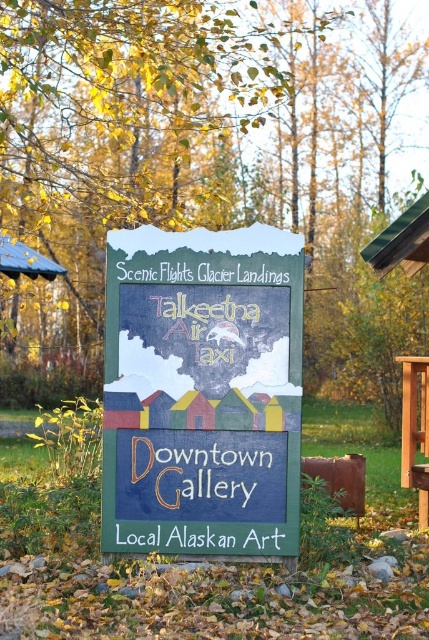
Question: Does wooden signboard at center come behind brown wooden picnic table at right?

Choices:
 (A) yes
 (B) no

Answer: (B)

Question: Is wooden signboard at center below brown wooden picnic table at right?

Choices:
 (A) no
 (B) yes

Answer: (A)

Question: Which of the following is the farthest from the observer?

Choices:
 (A) (407, 408)
 (B) (262, 240)

Answer: (A)

Question: Can you confirm if wooden signboard at center is positioned to the right of brown wooden picnic table at right?

Choices:
 (A) no
 (B) yes

Answer: (A)